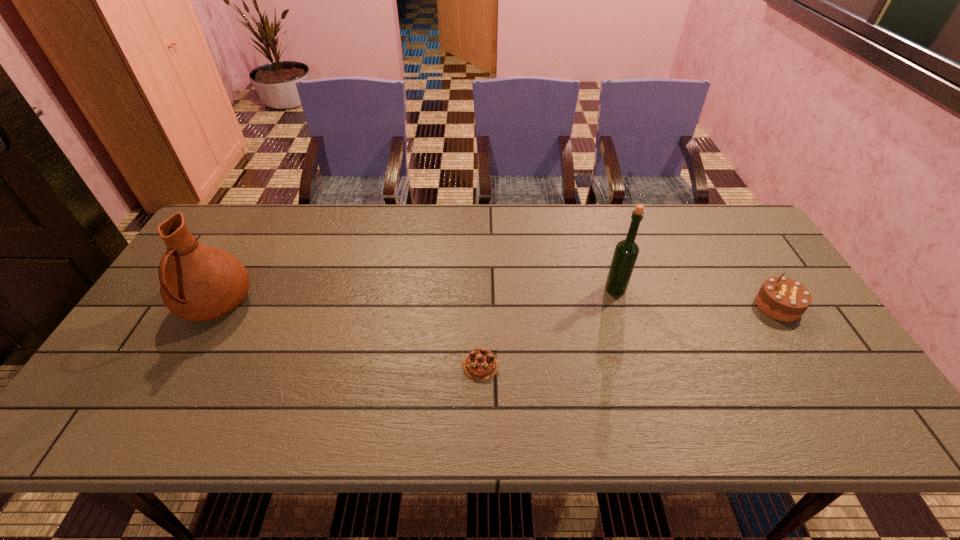
I want to click on vacant area that lies between the second object from right to left and the pitcher, so click(416, 297).

Identify the location of vacant point located between the pitcher and the taller chocolate cake. (497, 306).

The width and height of the screenshot is (960, 540). I want to click on vacant area that lies between the second shortest object and the liquor, so click(697, 298).

You are a GUI agent. You are given a task and a screenshot of the screen. Output one action in this format:
    pyautogui.click(x=<x>, y=<y>)
    Task: Click on the vacant space that is in between the nearest object and the pitcher
    The height and width of the screenshot is (540, 960).
    Given the screenshot: What is the action you would take?
    pyautogui.click(x=348, y=335)

Locate an element on the screen. The image size is (960, 540). free spot between the right chocolate cake and the shorter chocolate cake is located at coordinates (629, 336).

Where is `free spot between the pitcher and the nearest object`? free spot between the pitcher and the nearest object is located at coordinates (348, 335).

Locate an element on the screen. This screenshot has width=960, height=540. free area in between the liquor and the shortest object is located at coordinates (548, 327).

This screenshot has height=540, width=960. Identify the location of object that can be found as the second closest to the third tallest object. (480, 365).

Locate which object is the closest to the liquor. Please provide its 2D coordinates. Your answer should be formatted as a tuple, i.e. [(x, y)], where the tuple contains the x and y coordinates of a point satisfying the conditions above.

[(783, 299)]

Where is `vacant region that satisfies the following two spatial constraints: 1. on the back side of the shorter chocolate cake; 2. on the right side of the liquor`? This screenshot has width=960, height=540. vacant region that satisfies the following two spatial constraints: 1. on the back side of the shorter chocolate cake; 2. on the right side of the liquor is located at coordinates (480, 289).